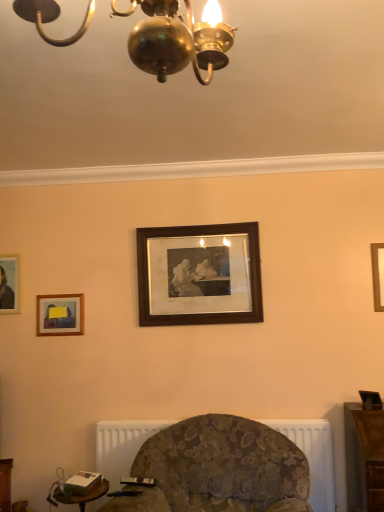
Question: Considering the relative sizes of brown wooden picture frame at center, which is counted as the 3th picture frame, starting from the left, and wooden picture frame at right, marked as the first picture frame in a right-to-left arrangement, in the image provided, is brown wooden picture frame at center, which is counted as the 3th picture frame, starting from the left, thinner than wooden picture frame at right, marked as the first picture frame in a right-to-left arrangement,?

Choices:
 (A) no
 (B) yes

Answer: (A)

Question: Considering the relative sizes of brown wooden picture frame at center, which appears as the 2th picture frame when viewed from the right, and wooden picture frame at right, marked as the first picture frame in a right-to-left arrangement, in the image provided, is brown wooden picture frame at center, which appears as the 2th picture frame when viewed from the right, taller than wooden picture frame at right, marked as the first picture frame in a right-to-left arrangement,?

Choices:
 (A) yes
 (B) no

Answer: (A)

Question: From a real-world perspective, does brown wooden picture frame at center, which appears as the 2th picture frame when viewed from the right, stand above wooden picture frame at right, marked as the first picture frame in a right-to-left arrangement?

Choices:
 (A) no
 (B) yes

Answer: (B)

Question: From a real-world perspective, is brown wooden picture frame at center, which appears as the 2th picture frame when viewed from the right, located beneath wooden picture frame at right, which appears as the 4th picture frame when viewed from the left?

Choices:
 (A) no
 (B) yes

Answer: (A)

Question: Is brown wooden picture frame at center, which is counted as the 3th picture frame, starting from the left, positioned in front of wooden picture frame at right, marked as the first picture frame in a right-to-left arrangement?

Choices:
 (A) no
 (B) yes

Answer: (A)

Question: Is point (104, 483) closer or farther from the camera than point (67, 317)?

Choices:
 (A) closer
 (B) farther

Answer: (A)

Question: In terms of size, does white plastic table at lower left appear bigger or smaller than matte gold picture frame at upper left, the 3th picture frame positioned from the right?

Choices:
 (A) big
 (B) small

Answer: (A)

Question: Considering their positions, is white plastic table at lower left located in front of or behind matte gold picture frame at upper left, marked as the 2th picture frame in a left-to-right arrangement?

Choices:
 (A) front
 (B) behind

Answer: (A)

Question: In terms of height, does white plastic table at lower left look taller or shorter compared to matte gold picture frame at upper left, the 3th picture frame positioned from the right?

Choices:
 (A) short
 (B) tall

Answer: (A)

Question: Looking at their shapes, would you say wooden picture frame at left, which is the first picture frame in left-to-right order, is wider or thinner than white plastic table at lower left?

Choices:
 (A) thin
 (B) wide

Answer: (A)

Question: Considering their positions, is wooden picture frame at left, which is the first picture frame in left-to-right order, located in front of or behind white plastic table at lower left?

Choices:
 (A) behind
 (B) front

Answer: (A)

Question: Do you think wooden picture frame at left, which is the first picture frame in left-to-right order, is within white plastic table at lower left, or outside of it?

Choices:
 (A) outside
 (B) inside

Answer: (A)

Question: Visually, is wooden picture frame at left, which is the first picture frame in left-to-right order, positioned to the left or to the right of white plastic table at lower left?

Choices:
 (A) left
 (B) right

Answer: (A)

Question: Does point (319, 486) appear closer or farther from the camera than point (104, 490)?

Choices:
 (A) farther
 (B) closer

Answer: (A)

Question: Looking at the image, does white textured radiator at lower center seem bigger or smaller compared to white plastic table at lower left?

Choices:
 (A) big
 (B) small

Answer: (A)